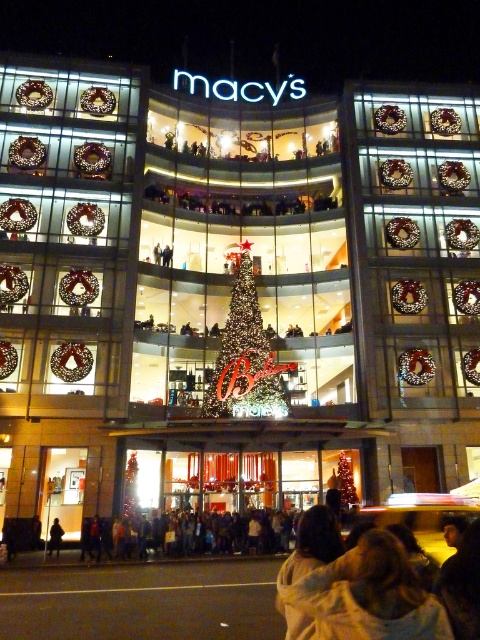
You are a customer looking for the entrance to the Macy store. You see an illuminated glass christmas tree at center and a dark brown leather jacket at lower left. Which object is closer to the entrance?

The dark brown leather jacket at lower left is closer to the entrance because the illuminated glass christmas tree at center is positioned over it, indicating it is further away from the entrance.